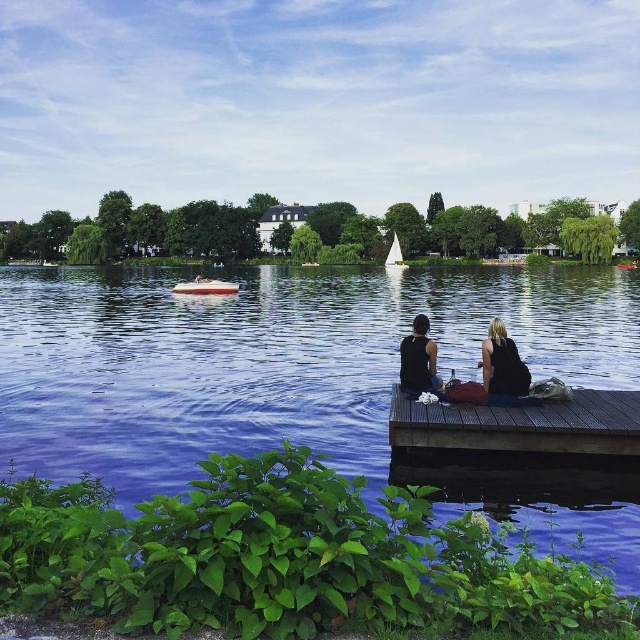
You are planning to take a photo of the blue water at center and the blonde hair at center from the lakeside. Which object should you focus on first if you want to capture both in a single frame without moving the camera?

You should focus on the blue water at center first because its width is larger than the blonde hair at center, allowing it to occupy more space in the frame while still including the blonde hair at center.

You are planning to row from the dock to the blue water at center using the white plastic boat at center. Given that the boat can carry a maximum weight of 300 pounds and you weigh 180 pounds, how much additional weight can you safely carry without exceeding the boat limit?

The question does not provide information about the distance between the blue water at center and the white plastic boat at center, so I cannot determine the additional weight capacity based on the given details. Please provide the distance between the two objects to calculate the safe load.

You are planning to launch a small toy boat into the blue water at center. The white plastic boat at center is already there. Based on their sizes, which one is larger?

The blue water at center is taller than the white plastic boat at center, so the blue water at center is larger.